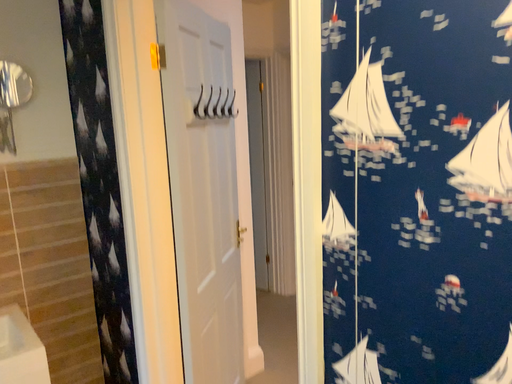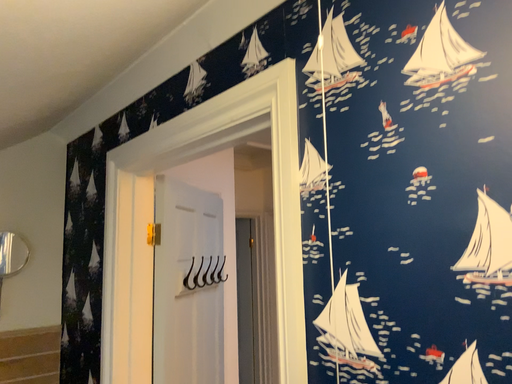
Question: How did the camera likely rotate when shooting the video?

Choices:
 (A) rotated upward
 (B) rotated downward

Answer: (A)